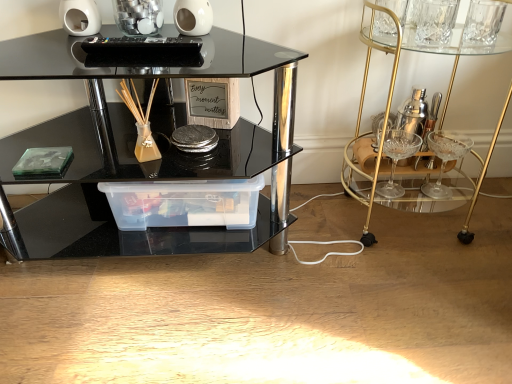
Question: Considering the relative sizes of gold glass bar cart at right and transparent plastic container at center in the image provided, is gold glass bar cart at right shorter than transparent plastic container at center?

Choices:
 (A) no
 (B) yes

Answer: (A)

Question: Does gold glass bar cart at right have a smaller size compared to transparent plastic container at center?

Choices:
 (A) yes
 (B) no

Answer: (B)

Question: Does gold glass bar cart at right lie behind transparent plastic container at center?

Choices:
 (A) yes
 (B) no

Answer: (B)

Question: Is gold glass bar cart at right facing away from transparent plastic container at center?

Choices:
 (A) no
 (B) yes

Answer: (A)

Question: Can you confirm if gold glass bar cart at right is wider than transparent plastic container at center?

Choices:
 (A) no
 (B) yes

Answer: (B)

Question: Is gold glass bar cart at right to the left or to the right of black glass table at center in the image?

Choices:
 (A) right
 (B) left

Answer: (A)

Question: From the image's perspective, is gold glass bar cart at right positioned above or below black glass table at center?

Choices:
 (A) above
 (B) below

Answer: (A)

Question: Considering the positions of gold glass bar cart at right and black glass table at center in the image, is gold glass bar cart at right bigger or smaller than black glass table at center?

Choices:
 (A) small
 (B) big

Answer: (A)

Question: Choose the correct answer: Is gold glass bar cart at right inside black glass table at center or outside it?

Choices:
 (A) outside
 (B) inside

Answer: (A)

Question: In the image, is transparent plastic container at center on the left side or the right side of black glass table at center?

Choices:
 (A) left
 (B) right

Answer: (B)

Question: From the image's perspective, relative to black glass table at center, is transparent plastic container at center above or below?

Choices:
 (A) above
 (B) below

Answer: (B)

Question: Is transparent plastic container at center situated inside black glass table at center or outside?

Choices:
 (A) inside
 (B) outside

Answer: (A)

Question: Is transparent plastic container at center taller or shorter than black glass table at center?

Choices:
 (A) short
 (B) tall

Answer: (A)

Question: Is black glass table at center situated inside transparent plastic container at center or outside?

Choices:
 (A) inside
 (B) outside

Answer: (B)

Question: Is black glass table at center wider or thinner than transparent plastic container at center?

Choices:
 (A) wide
 (B) thin

Answer: (A)